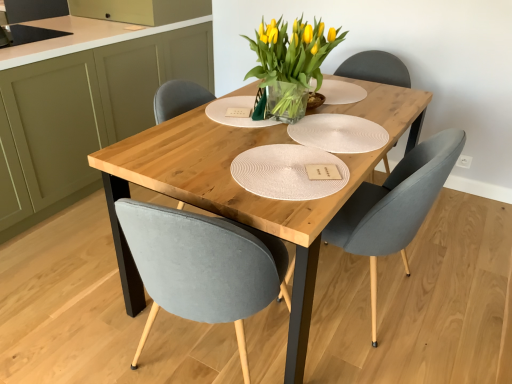
The image size is (512, 384). In order to click on free space below velvet grey chair at center (from a real-world perspective) in this screenshot , I will do `click(382, 308)`.